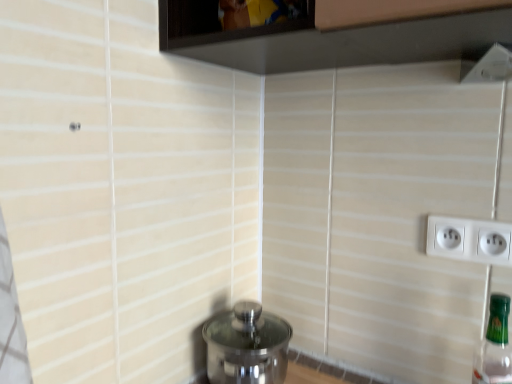
Where is `polished stainless steel water heater at lower center`? Image resolution: width=512 pixels, height=384 pixels. polished stainless steel water heater at lower center is located at coordinates (247, 345).

Measure the distance between white plastic power plugs and sockets at right and camera.

28.14 inches.

I want to click on transparent glass window at upper center, so click(229, 20).

Identify the location of polished stainless steel water heater at lower center. (247, 345).

Is green glass bottle at right touching polished stainless steel water heater at lower center?

They are not placed beside each other.

This screenshot has width=512, height=384. Find the location of `water heater that appears behind the green glass bottle at right`. water heater that appears behind the green glass bottle at right is located at coordinates (247, 345).

Is green glass bottle at right bigger or smaller than polished stainless steel water heater at lower center?

Considering their sizes, green glass bottle at right takes up less space than polished stainless steel water heater at lower center.

Is point (489, 377) in front of point (260, 319)?

Yes, it is in front of point (260, 319).

Is transparent glass window at upper center not close to polished stainless steel water heater at lower center?

No, transparent glass window at upper center is not far from polished stainless steel water heater at lower center.

Where is `window on the right of polished stainless steel water heater at lower center`? This screenshot has height=384, width=512. window on the right of polished stainless steel water heater at lower center is located at coordinates (229, 20).

Considering the sizes of objects transparent glass window at upper center and polished stainless steel water heater at lower center in the image provided, who is bigger, transparent glass window at upper center or polished stainless steel water heater at lower center?

With larger size is polished stainless steel water heater at lower center.

Is transparent glass window at upper center positioned before polished stainless steel water heater at lower center?

Yes.

Is white plastic power plugs and sockets at right looking in the opposite direction of transparent glass window at upper center?

No.

Is white plastic power plugs and sockets at right wider or thinner than transparent glass window at upper center?

Considering their sizes, white plastic power plugs and sockets at right looks slimmer than transparent glass window at upper center.

How many degrees apart are the facing directions of white plastic power plugs and sockets at right and transparent glass window at upper center?

They differ by 0.000313 degrees in their facing directions.

Where is `power plugs and sockets behind the transparent glass window at upper center`? The width and height of the screenshot is (512, 384). power plugs and sockets behind the transparent glass window at upper center is located at coordinates (470, 240).

Is transparent glass window at upper center thinner than white plastic power plugs and sockets at right?

Incorrect, the width of transparent glass window at upper center is not less than that of white plastic power plugs and sockets at right.

From a real-world perspective, is transparent glass window at upper center physically below white plastic power plugs and sockets at right?

No, from a real-world perspective, transparent glass window at upper center is not under white plastic power plugs and sockets at right.

This screenshot has width=512, height=384. What are the coordinates of `power plugs and sockets behind the transparent glass window at upper center` in the screenshot? It's located at (470, 240).

Is green glass bottle at right in front of transparent glass window at upper center?

Yes, green glass bottle at right is in front of transparent glass window at upper center.

Would you say green glass bottle at right is outside transparent glass window at upper center?

green glass bottle at right lies outside transparent glass window at upper center's area.

From a real-world perspective, does green glass bottle at right stand above transparent glass window at upper center?

No.

From the image's perspective, which one is positioned lower, green glass bottle at right or transparent glass window at upper center?

From the image's view, green glass bottle at right is below.

Is white plastic power plugs and sockets at right positioned behind green glass bottle at right?

Yes, white plastic power plugs and sockets at right is behind green glass bottle at right.

At what (x,y) coordinates should I click in order to perform the action: click on bottle to the right of white plastic power plugs and sockets at right. Please return your answer as a coordinate pair (x, y). The image size is (512, 384). Looking at the image, I should click on (494, 346).

Which object is thinner, white plastic power plugs and sockets at right or green glass bottle at right?

Thinner between the two is white plastic power plugs and sockets at right.

From the image's perspective, is white plastic power plugs and sockets at right above or below green glass bottle at right?

From the image's perspective, white plastic power plugs and sockets at right appears above green glass bottle at right.

From the image's perspective, who appears lower, polished stainless steel water heater at lower center or transparent glass window at upper center?

polished stainless steel water heater at lower center appears lower in the image.

Find the location of a particular element. water heater that appears below the transparent glass window at upper center (from the image's perspective) is located at coordinates (247, 345).

Is polished stainless steel water heater at lower center located outside transparent glass window at upper center?

polished stainless steel water heater at lower center lies outside transparent glass window at upper center's area.

At what (x,y) coordinates should I click in order to perform the action: click on bottle that is above the polished stainless steel water heater at lower center (from a real-world perspective). Please return your answer as a coordinate pair (x, y). Looking at the image, I should click on (494, 346).

Identify the location of water heater located on the left of transparent glass window at upper center. The width and height of the screenshot is (512, 384). (247, 345).

When comparing their distances from transparent glass window at upper center, does white plastic power plugs and sockets at right or polished stainless steel water heater at lower center seem closer?

white plastic power plugs and sockets at right.

Based on their spatial positions, is transparent glass window at upper center or green glass bottle at right further from polished stainless steel water heater at lower center?

transparent glass window at upper center.

Based on their spatial positions, is polished stainless steel water heater at lower center or green glass bottle at right further from transparent glass window at upper center?

green glass bottle at right lies further to transparent glass window at upper center than the other object.

Based on their spatial positions, is polished stainless steel water heater at lower center or white plastic power plugs and sockets at right further from green glass bottle at right?

polished stainless steel water heater at lower center is positioned further to the anchor green glass bottle at right.

From the image, which object appears to be nearer to white plastic power plugs and sockets at right, transparent glass window at upper center or polished stainless steel water heater at lower center?

The object closer to white plastic power plugs and sockets at right is polished stainless steel water heater at lower center.

Based on their spatial positions, is green glass bottle at right or white plastic power plugs and sockets at right further from polished stainless steel water heater at lower center?

The object further to polished stainless steel water heater at lower center is green glass bottle at right.

Considering their positions, is polished stainless steel water heater at lower center positioned further to white plastic power plugs and sockets at right than green glass bottle at right?

polished stainless steel water heater at lower center.

Looking at the image, which one is located closer to polished stainless steel water heater at lower center, white plastic power plugs and sockets at right or green glass bottle at right?

white plastic power plugs and sockets at right is positioned closer to the anchor polished stainless steel water heater at lower center.

Find the location of a particular element. The height and width of the screenshot is (384, 512). power plugs and sockets between polished stainless steel water heater at lower center and green glass bottle at right from left to right is located at coordinates coord(470,240).

Locate an element on the screen. power plugs and sockets that lies between transparent glass window at upper center and polished stainless steel water heater at lower center from top to bottom is located at coordinates (470, 240).

Find the location of a particular element. This screenshot has width=512, height=384. bottle that lies between transparent glass window at upper center and polished stainless steel water heater at lower center from top to bottom is located at coordinates (494, 346).

I want to click on power plugs and sockets between transparent glass window at upper center and green glass bottle at right from top to bottom, so click(x=470, y=240).